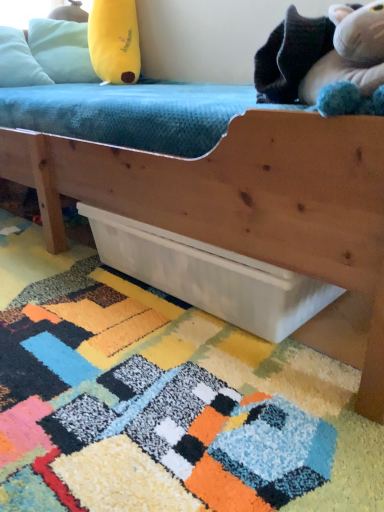
The height and width of the screenshot is (512, 384). I want to click on empty space that is ontop of multicolored shaggy rug at lower center (from a real-world perspective), so click(112, 351).